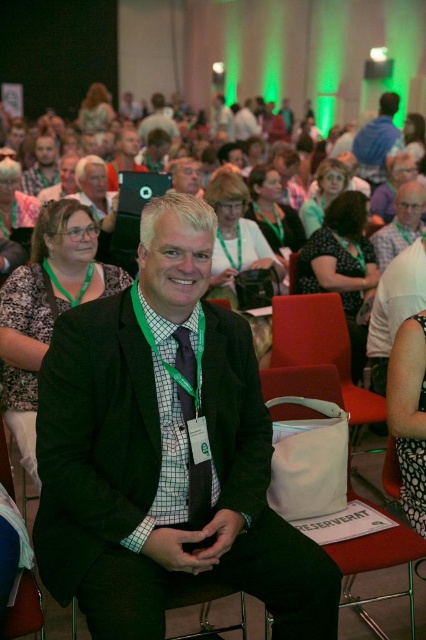
You are an event photographer at the conference and need to capture a clear shot of the speaker wearing both the black textured blazer at center and the matte black glasses at center. Based on their positions, which object is positioned to the left of the other?

The black textured blazer at center is to the left of the matte black glasses at center.

You are organizing a photo shoot in this conference hall and need to position two key items. The black matte suit at center and the matte blue shirt at upper right must be placed such that they are exactly 5 meters apart. Based on the current setup, will you need to move either item to achieve this requirement?

The current distance between the black matte suit at center and the matte blue shirt at upper right is 5.45 meters. Since this is more than the required 5 meters, you would need to move them closer by 0.45 meters to meet the 5 meter requirement.

You are organizing a seating arrangement for a conference and need to place a white fabric chair at lower center and a matte blue shirt at upper right. Which object requires more space due to its larger size?

The matte blue shirt at upper right requires more space due to its larger size compared to the white fabric chair at lower center.